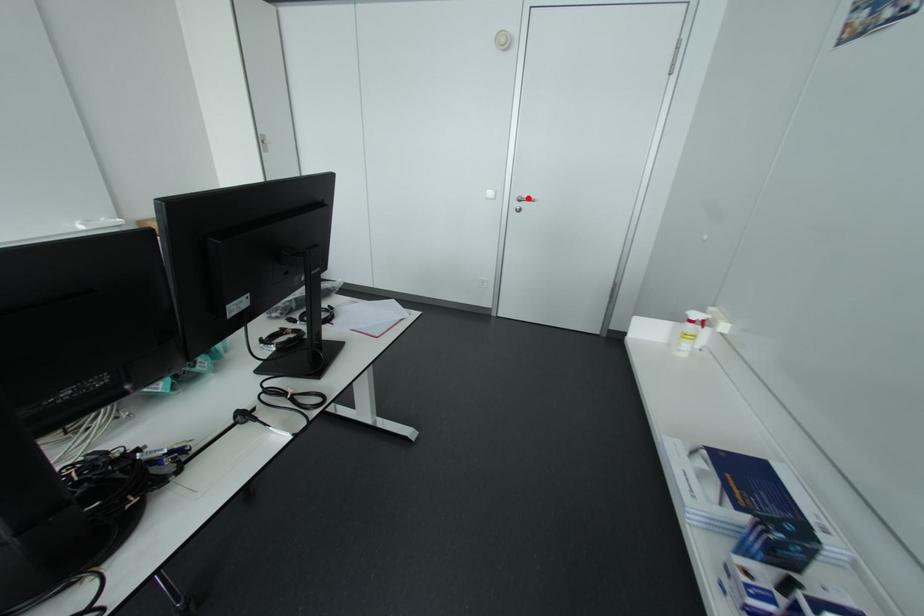
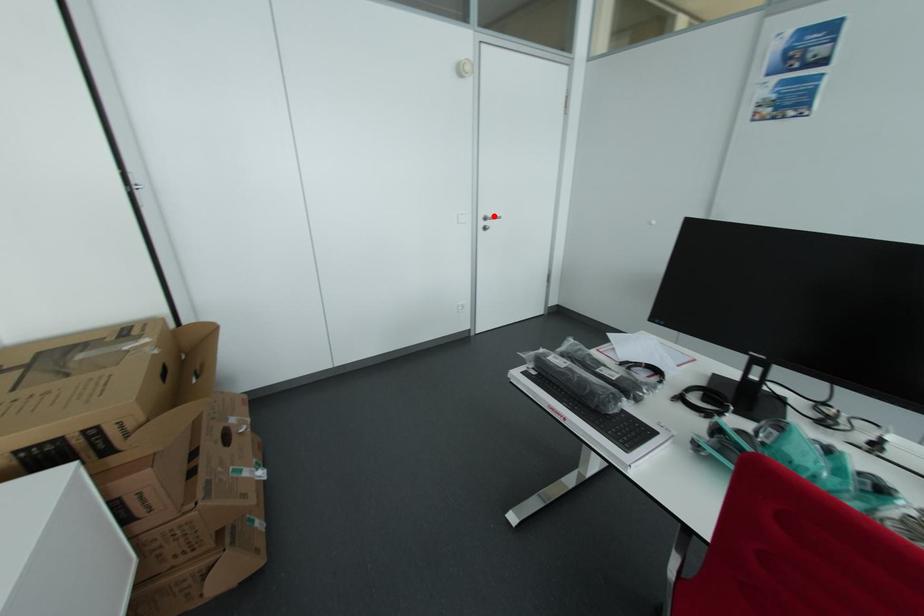
I am providing you with two images of the same scene from different viewpoints. A red point is marked on the first image and another point is marked on the second image. Do the highlighted points in image1 and image2 indicate the same real-world spot?

Yes